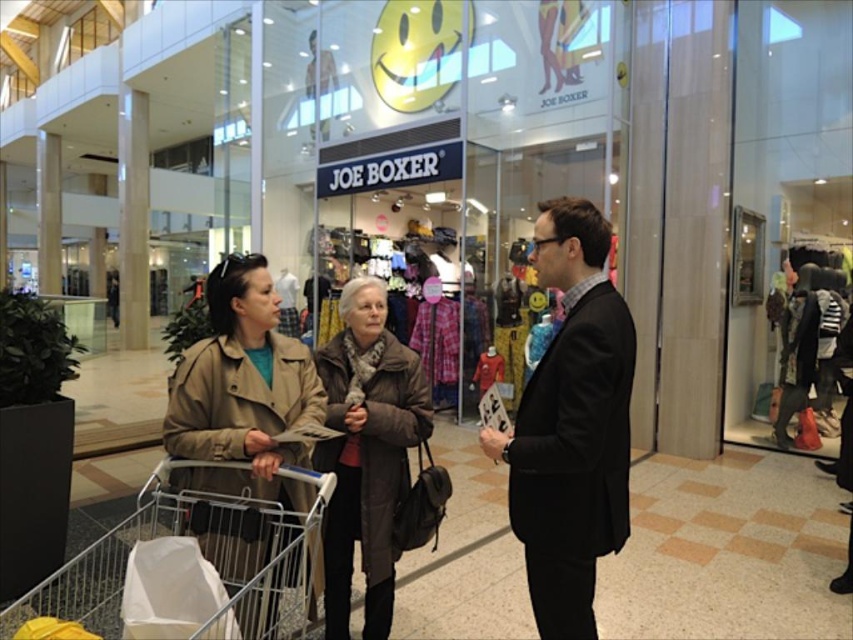
You are a delivery person who needs to place a package in the metallic silver shopping cart at lower left. The package is 32 inches long. Can the package fit in the cart if you place it next to the black suit at center?

The black suit at center is 31.22 inches away from the metallic silver shopping cart at lower left. Since the package is 32 inches long, it is slightly longer than the available space between them. Therefore, the package cannot fit in the cart if placed next to the black suit at center.

You are a store employee at Joe Boxer and need to place two coats in the window display. The tan leather coat at lower left and the brown fuzzy coat at center are both candidates. Which coat should you choose if you want to display a larger coat?

The tan leather coat at lower left is larger in size than the brown fuzzy coat at center, so you should choose the tan leather coat at lower left for the window display.

You are a photographer who needs to take a photo of the black suit at center from a distance of 1.66 meters. Can you position yourself right next to the camera to do so?

The black suit at center and camera are 1.66 meters apart, so yes, you can position yourself next to the camera to take the photo since the distance between them matches the required distance.